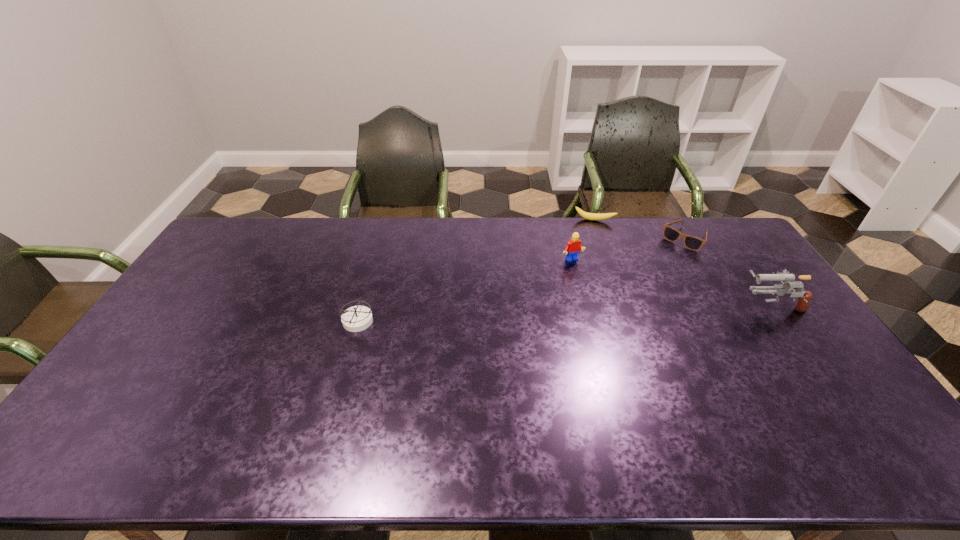
At what (x,y) coordinates should I click in order to perform the action: click on banana located at the far edge. Please return your answer as a coordinate pair (x, y). This screenshot has height=540, width=960. Looking at the image, I should click on (589, 216).

Where is `sunglasses that is at the far edge`? Image resolution: width=960 pixels, height=540 pixels. sunglasses that is at the far edge is located at coordinates (693, 243).

The image size is (960, 540). Find the location of `gun at the right edge`. gun at the right edge is located at coordinates (804, 297).

At what (x,y) coordinates should I click in order to perform the action: click on sunglasses at the right edge. Please return your answer as a coordinate pair (x, y). Image resolution: width=960 pixels, height=540 pixels. Looking at the image, I should click on (693, 243).

The width and height of the screenshot is (960, 540). Identify the location of object situated at the far right corner. (693, 243).

Image resolution: width=960 pixels, height=540 pixels. In order to click on free location at the far edge of the desktop in this screenshot , I will do (x=339, y=241).

You are a GUI agent. You are given a task and a screenshot of the screen. Output one action in this format:
    pyautogui.click(x=<x>, y=<y>)
    Task: Click on the free spot at the near edge of the desktop
    This screenshot has width=960, height=540.
    Given the screenshot: What is the action you would take?
    pyautogui.click(x=332, y=420)

Find the location of a particular element. The image size is (960, 540). free space at the left edge of the desktop is located at coordinates (178, 316).

You are a GUI agent. You are given a task and a screenshot of the screen. Output one action in this format:
    pyautogui.click(x=<x>, y=<y>)
    Task: Click on the vacant region at the right edge of the desktop
    
    Given the screenshot: What is the action you would take?
    pyautogui.click(x=778, y=335)

What are the coordinates of `free space between the farthest object and the Lego` in the screenshot? It's located at (583, 240).